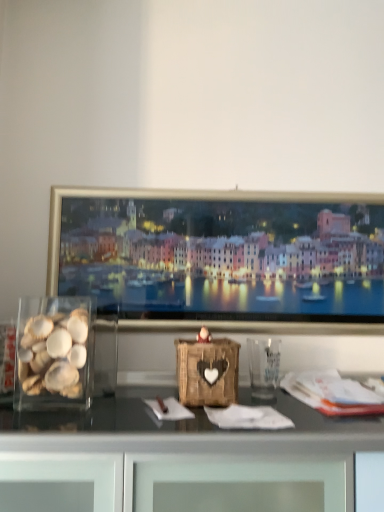
Question: From a real-world perspective, is translucent glass shells at left below transparent plastic glass at center?

Choices:
 (A) yes
 (B) no

Answer: (B)

Question: From a real-world perspective, is translucent glass shells at left on top of transparent plastic glass at center?

Choices:
 (A) yes
 (B) no

Answer: (A)

Question: Does translucent glass shells at left have a greater width compared to transparent plastic glass at center?

Choices:
 (A) no
 (B) yes

Answer: (B)

Question: Is translucent glass shells at left with transparent plastic glass at center?

Choices:
 (A) yes
 (B) no

Answer: (B)

Question: Can you confirm if translucent glass shells at left is smaller than transparent plastic glass at center?

Choices:
 (A) no
 (B) yes

Answer: (A)

Question: Considering the relative sizes of translucent glass shells at left and transparent plastic glass at center in the image provided, is translucent glass shells at left shorter than transparent plastic glass at center?

Choices:
 (A) yes
 (B) no

Answer: (B)

Question: From the image's perspective, is transparent plastic glass at center on translucent glass shells at left?

Choices:
 (A) yes
 (B) no

Answer: (B)

Question: Is transparent plastic glass at center oriented away from translucent glass shells at left?

Choices:
 (A) yes
 (B) no

Answer: (B)

Question: Does transparent plastic glass at center have a greater height compared to translucent glass shells at left?

Choices:
 (A) yes
 (B) no

Answer: (B)

Question: From the image's perspective, is transparent plastic glass at center below translucent glass shells at left?

Choices:
 (A) yes
 (B) no

Answer: (A)

Question: Is transparent plastic glass at center closer to the viewer compared to translucent glass shells at left?

Choices:
 (A) no
 (B) yes

Answer: (A)

Question: Is transparent plastic glass at center smaller than translucent glass shells at left?

Choices:
 (A) no
 (B) yes

Answer: (B)

Question: From a real-world perspective, is translucent glass shells at left positioned above or below transparent plastic glass at center?

Choices:
 (A) below
 (B) above

Answer: (B)